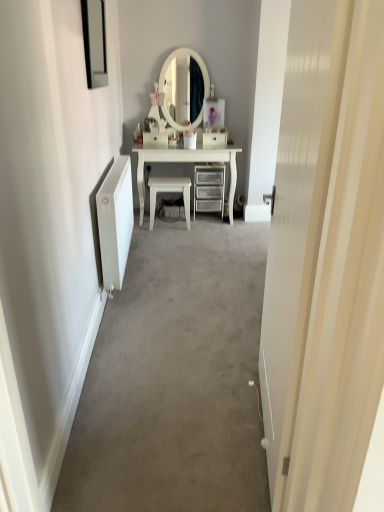
Question: Is white glossy chair at center to the right of metallic silver chest of drawers at center from the viewer's perspective?

Choices:
 (A) no
 (B) yes

Answer: (A)

Question: Is white glossy chair at center not close to metallic silver chest of drawers at center?

Choices:
 (A) yes
 (B) no

Answer: (B)

Question: Can you confirm if white glossy chair at center is thinner than metallic silver chest of drawers at center?

Choices:
 (A) no
 (B) yes

Answer: (B)

Question: Does white glossy chair at center contain metallic silver chest of drawers at center?

Choices:
 (A) no
 (B) yes

Answer: (A)

Question: From the image's perspective, is white glossy chair at center located above metallic silver chest of drawers at center?

Choices:
 (A) no
 (B) yes

Answer: (A)

Question: Considering the positions of white glossy drawer at center, which appears as the first drawer when viewed from the right, and metallic silver chest of drawers at center in the image, is white glossy drawer at center, which appears as the first drawer when viewed from the right, bigger or smaller than metallic silver chest of drawers at center?

Choices:
 (A) small
 (B) big

Answer: (A)

Question: Is white glossy drawer at center, the 2th drawer viewed from the left, situated inside metallic silver chest of drawers at center or outside?

Choices:
 (A) outside
 (B) inside

Answer: (A)

Question: From a real-world perspective, is white glossy drawer at center, the 2th drawer viewed from the left, positioned above or below metallic silver chest of drawers at center?

Choices:
 (A) above
 (B) below

Answer: (A)

Question: Looking at their shapes, would you say white glossy drawer at center, the 2th drawer viewed from the left, is wider or thinner than metallic silver chest of drawers at center?

Choices:
 (A) thin
 (B) wide

Answer: (A)

Question: Based on their positions, is white glossy chair at center located to the left or right of white wood door at center?

Choices:
 (A) right
 (B) left

Answer: (B)

Question: Is white glossy chair at center in front of or behind white wood door at center in the image?

Choices:
 (A) behind
 (B) front

Answer: (A)

Question: From their relative heights in the image, would you say white glossy chair at center is taller or shorter than white wood door at center?

Choices:
 (A) short
 (B) tall

Answer: (A)

Question: From the image's perspective, is white glossy chair at center positioned above or below white wood door at center?

Choices:
 (A) below
 (B) above

Answer: (B)

Question: From the image's perspective, is white glossy drawer at center, acting as the second drawer starting from the right, positioned above or below black glass picture frame at upper left?

Choices:
 (A) below
 (B) above

Answer: (A)

Question: Considering the positions of point pyautogui.click(x=160, y=140) and point pyautogui.click(x=92, y=1), is point pyautogui.click(x=160, y=140) closer or farther from the camera than point pyautogui.click(x=92, y=1)?

Choices:
 (A) closer
 (B) farther

Answer: (B)